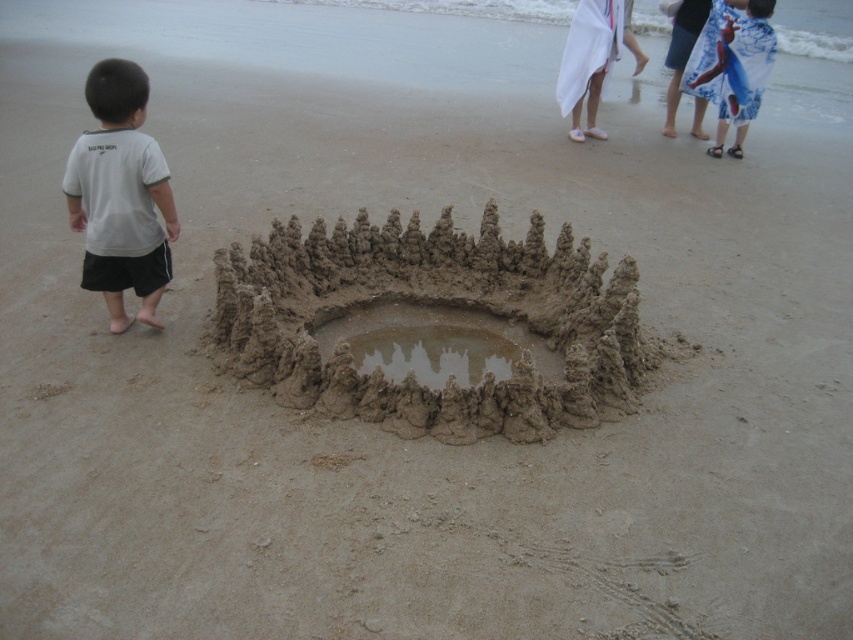
Question: Based on their relative distances, which object is farther from the blue printed dress at upper right?

Choices:
 (A) brown sandy hole at center
 (B) white cotton shirt at left

Answer: (B)

Question: Is white cotton shirt at left bigger than blue printed dress at upper right?

Choices:
 (A) no
 (B) yes

Answer: (A)

Question: Does white cotton shirt at left have a lesser width compared to brown sandy hole at center?

Choices:
 (A) no
 (B) yes

Answer: (B)

Question: Which point appears farthest from the camera in this image?

Choices:
 (A) (125, 188)
 (B) (735, 12)
 (C) (361, 392)

Answer: (B)

Question: Which of the following is the farthest from the observer?

Choices:
 (A) (373, 330)
 (B) (756, 54)
 (C) (115, 168)

Answer: (B)

Question: Does white cotton shirt at left have a lesser width compared to blue printed dress at upper right?

Choices:
 (A) yes
 (B) no

Answer: (A)